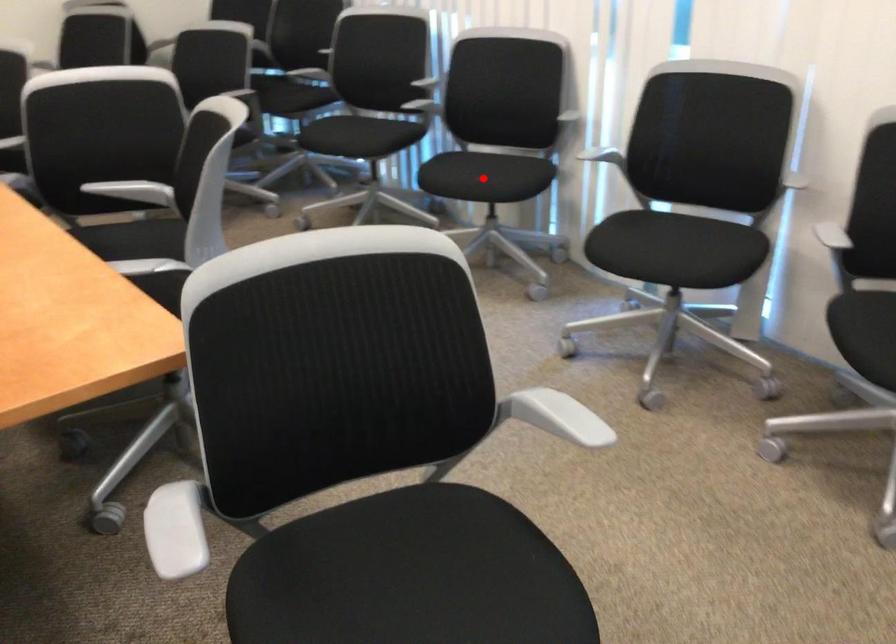
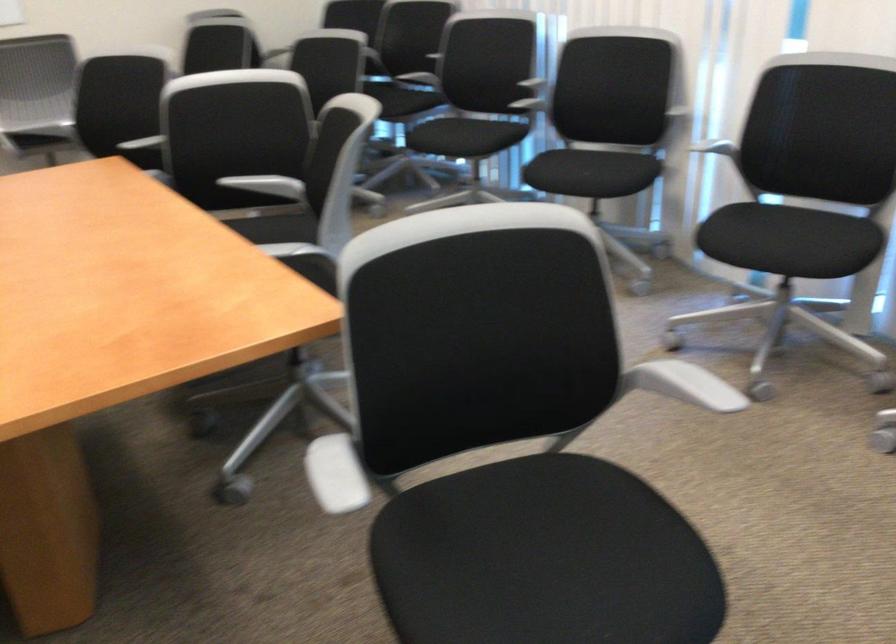
Question: I am providing you with two images of the same scene from different viewpoints. A red point is marked on the first image. Is the red point's position out of view in image 2?

Choices:
 (A) Yes
 (B) No

Answer: (B)